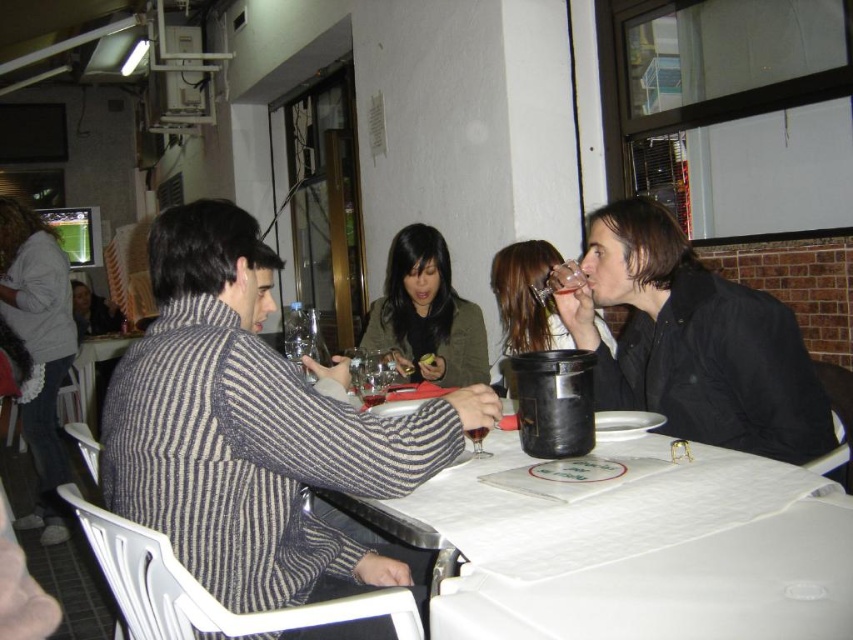
You are a waiter at this outdoor restaurant and need to place a new order of appetizers on the table. The appetizers must be placed exactly at the point with coordinates point (x=642, y=554). Where should you place the appetizers on the table?

The appetizers should be placed at point (x=642, y=554) on the white textured table at center.